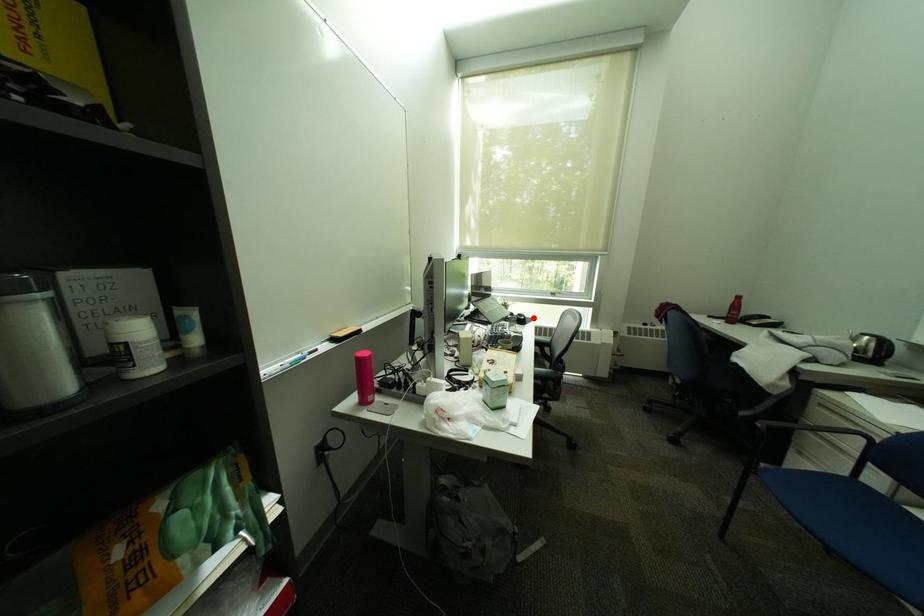
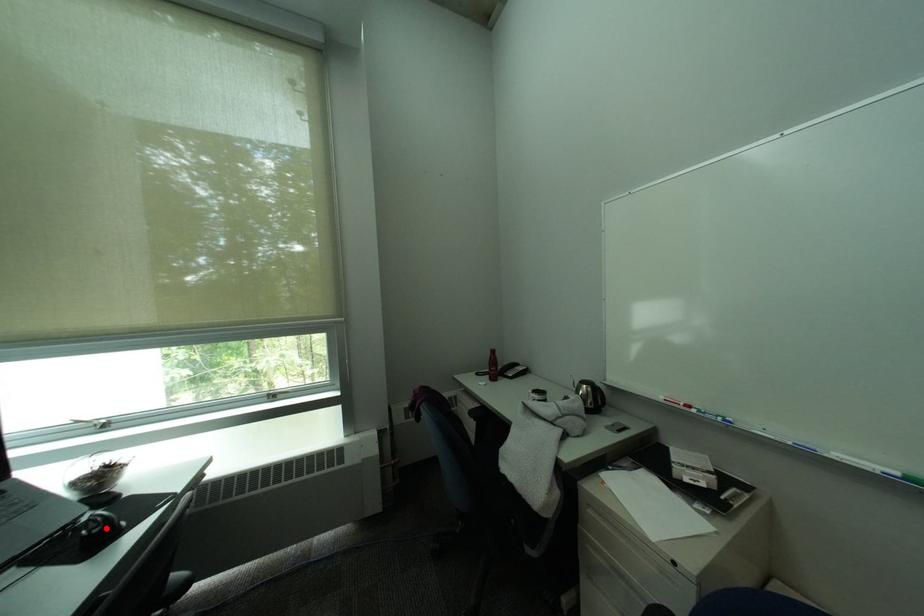
I am providing you with two images of the same scene from different viewpoints. A red point is marked on the first image and another point is marked on the second image. Are the points marked in image1 and image2 representing the same 3D position?

Yes